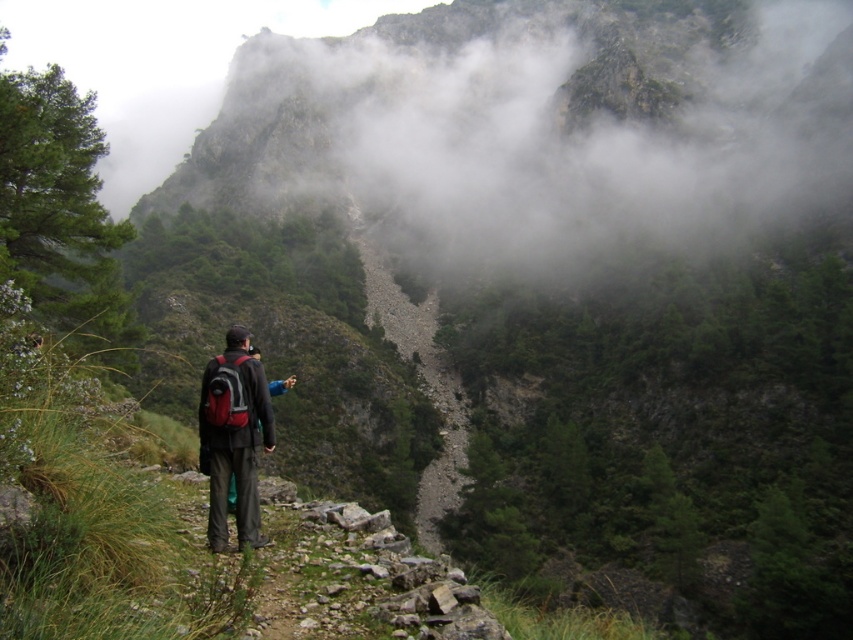
In the scene shown: You are a hiker navigating a rocky path and need to place a marker at the point closer to you. Which point should you choose between point (426, 307) and point (267, 444)?

Point (426, 307) is further to the viewer than point (267, 444), so you should choose point (267, 444) as it is closer to you.

You are a hiker trying to navigate the gray rocky trail at center while carrying the matte black backpack at center. Which object is closer to you as you stand on the trail?

The gray rocky trail at center is closer to you than the matte black backpack at center because the trail is positioned further to the viewer, meaning it appears nearer in your perspective.

You are a hiker trying to navigate a narrow rocky path in a mountainous area. You have a map that marks a specific point at coordinates (419, 374). According to the map, what does this point represent?

The point at coordinates (419, 374) indicates the gray rocky trail at center, so this point represents the gray rocky trail at center on the map.